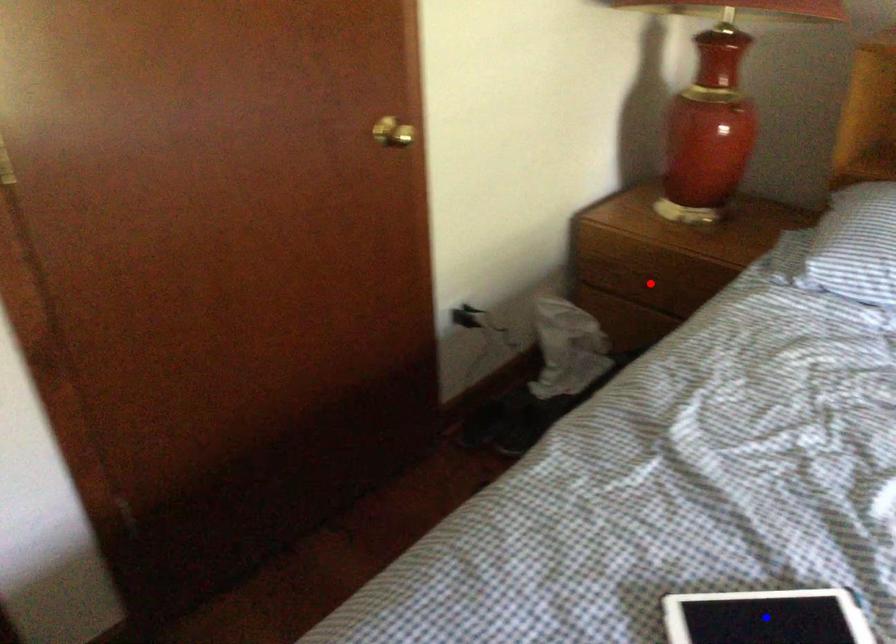
Question: In the image, two points are highlighted. Which point is nearer to the camera? Reply with the corresponding letter.

Choices:
 (A) blue point
 (B) red point

Answer: (A)